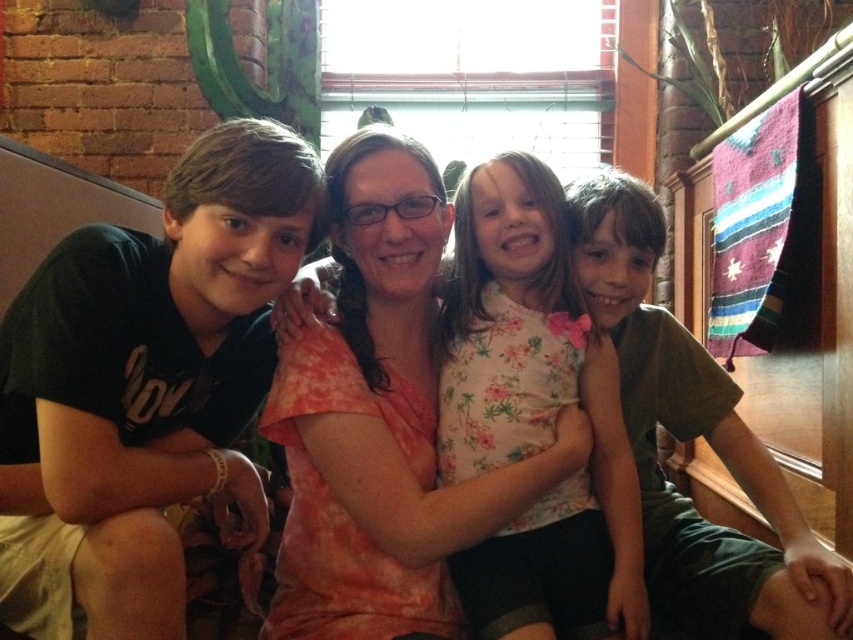
You are a photographer setting up for a family portrait. You have a camera with a 1.5 meter wide lens. The scene includes a floral fabric dress at center and a matte green shirt at right. Can both objects fit within the camera lens width if they are placed side by side?

The floral fabric dress at center is smaller than the matte green shirt at right. However, the combined width of both objects is not provided. Without knowing their exact sizes, it is impossible to determine if they can fit within the 1.5 meter lens width.

You are standing in the room and want to place a small gift on the table nearest to you. The table at point (381, 180) is closer than the one at (521, 353). Which point should you go to?

You should go to point (381, 180) because it is closer to you than point (521, 353).